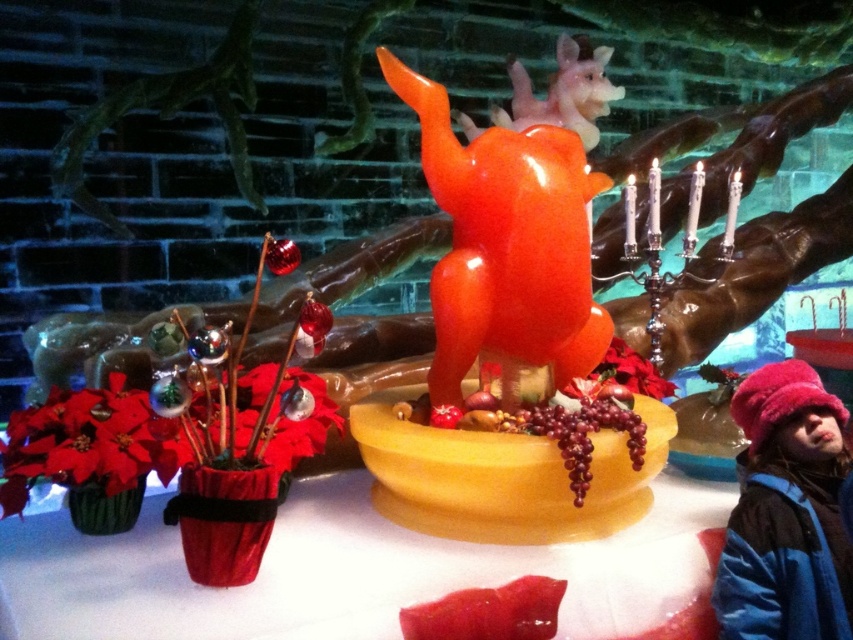
Does translucent yellow bowl at center appear under glossy plastic reindeer at upper center?

Correct, translucent yellow bowl at center is located below glossy plastic reindeer at upper center.

Can you confirm if translucent yellow bowl at center is shorter than glossy plastic reindeer at upper center?

Indeed, translucent yellow bowl at center has a lesser height compared to glossy plastic reindeer at upper center.

Which is behind, point (408, 595) or point (589, 100)?

The point (589, 100) is behind.

The image size is (853, 640). Find the location of `translucent yellow bowl at center`. translucent yellow bowl at center is located at coordinates (347, 570).

Is fuzzy pink hat at lower right smaller than glossy plastic reindeer at upper center?

Correct, fuzzy pink hat at lower right occupies less space than glossy plastic reindeer at upper center.

Between fuzzy pink hat at lower right and glossy plastic reindeer at upper center, which one has less height?

With less height is fuzzy pink hat at lower right.

What do you see at coordinates (786, 513) in the screenshot? Image resolution: width=853 pixels, height=640 pixels. I see `fuzzy pink hat at lower right` at bounding box center [786, 513].

The height and width of the screenshot is (640, 853). In order to click on fuzzy pink hat at lower right in this screenshot , I will do `click(786, 513)`.

Who is shorter, translucent yellow bowl at center or shiny orange sculpture at center?

translucent yellow bowl at center is shorter.

Which is behind, point (587, 592) or point (570, 342)?

The point (570, 342) is more distant.

Is point (367, 540) positioned before point (461, 230)?

Yes, it is.

Where is `translucent yellow bowl at center`? translucent yellow bowl at center is located at coordinates (347, 570).